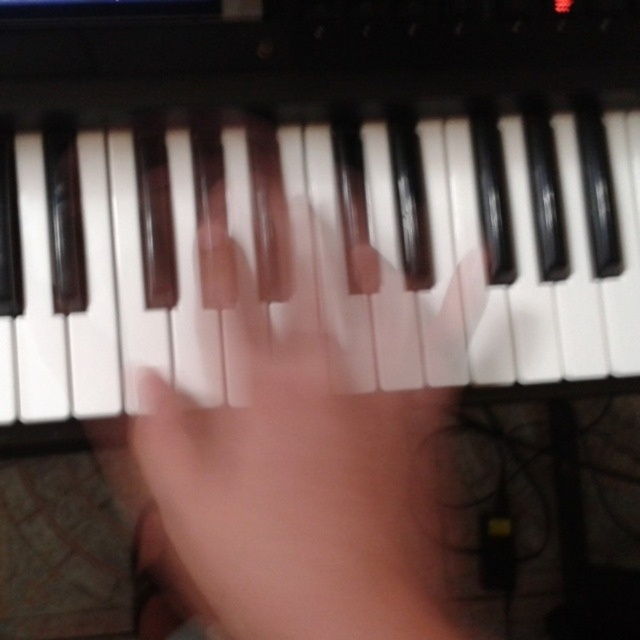
Which is more to the left, white matte piano keys at center or satin black hand at center?

white matte piano keys at center is more to the left.

Can you confirm if white matte piano keys at center is thinner than satin black hand at center?

No.

Who is more forward, (35, 344) or (182, 440)?

Point (182, 440) is more forward.

Where is `white matte piano keys at center`? This screenshot has width=640, height=640. white matte piano keys at center is located at coordinates (323, 198).